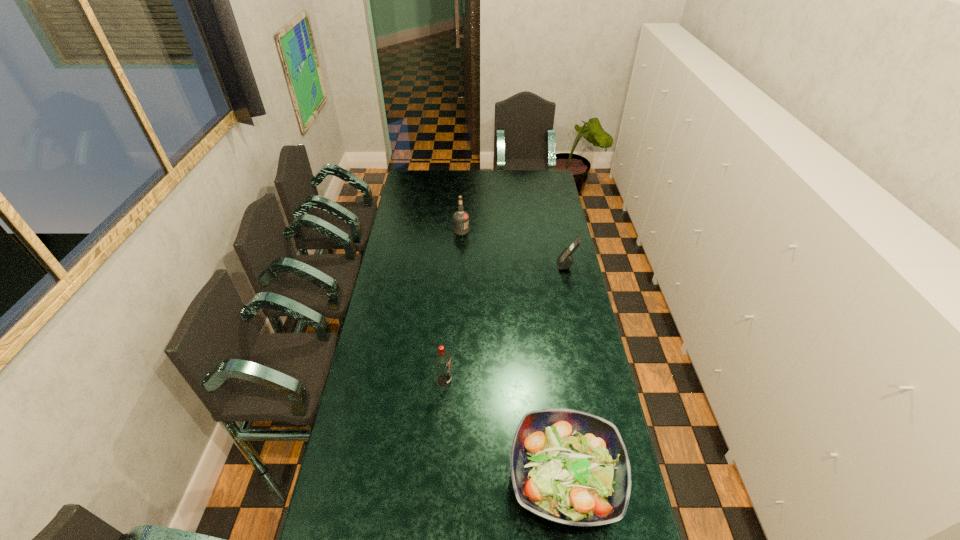
This screenshot has height=540, width=960. I want to click on free space located 0.240m on the front-facing side of the cellular telephone, so click(508, 265).

Find the location of a particular element. vacant area situated 0.390m on the back of the shortest object is located at coordinates (546, 337).

I want to click on cellular telephone situated at the right edge, so click(x=565, y=260).

Locate an element on the screen. The width and height of the screenshot is (960, 540). salad plate that is at the right edge is located at coordinates (571, 467).

Identify the location of vacant region at the far edge of the desktop. Image resolution: width=960 pixels, height=540 pixels. [500, 170].

Where is `free space at the left edge`? The height and width of the screenshot is (540, 960). free space at the left edge is located at coordinates (399, 279).

In the image, there is a desktop. Where is `free space at the right edge`? free space at the right edge is located at coordinates (552, 236).

In the image, there is a desktop. Identify the location of vacant space at the far left corner. Image resolution: width=960 pixels, height=540 pixels. [427, 190].

In the image, there is a desktop. What are the coordinates of `vacant space at the far right corner` in the screenshot? It's located at (542, 183).

The height and width of the screenshot is (540, 960). I want to click on free space that is in between the farthest object and the nearer vodka, so click(453, 306).